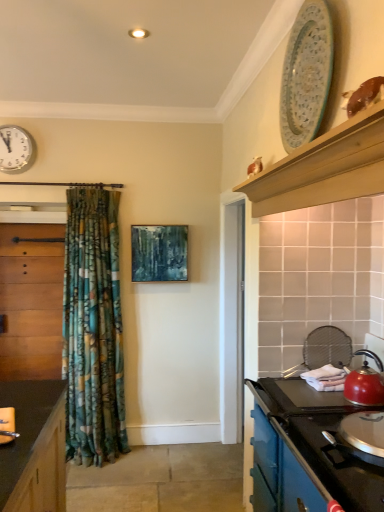
Identify the location of vacant space positioned to the left of matte red kettle at right. (310, 397).